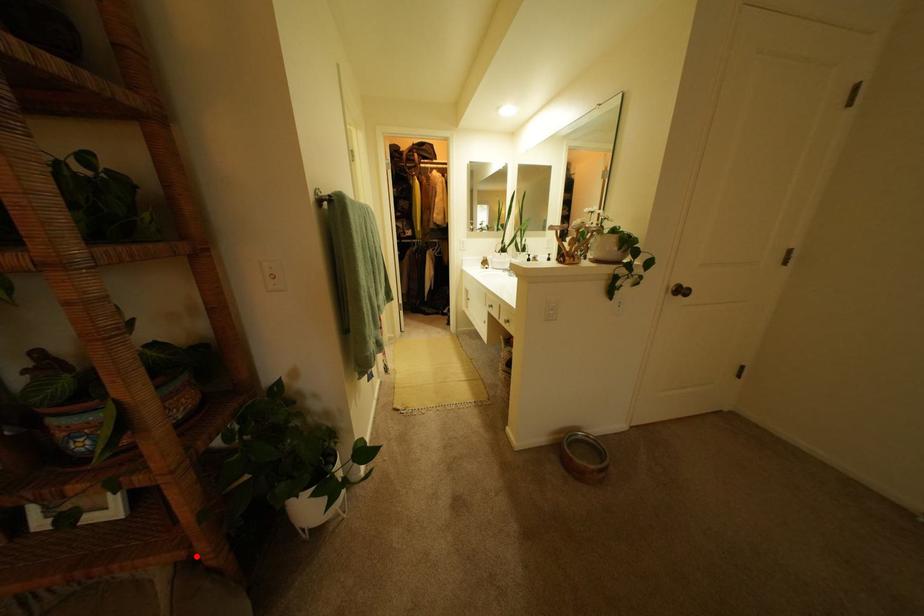
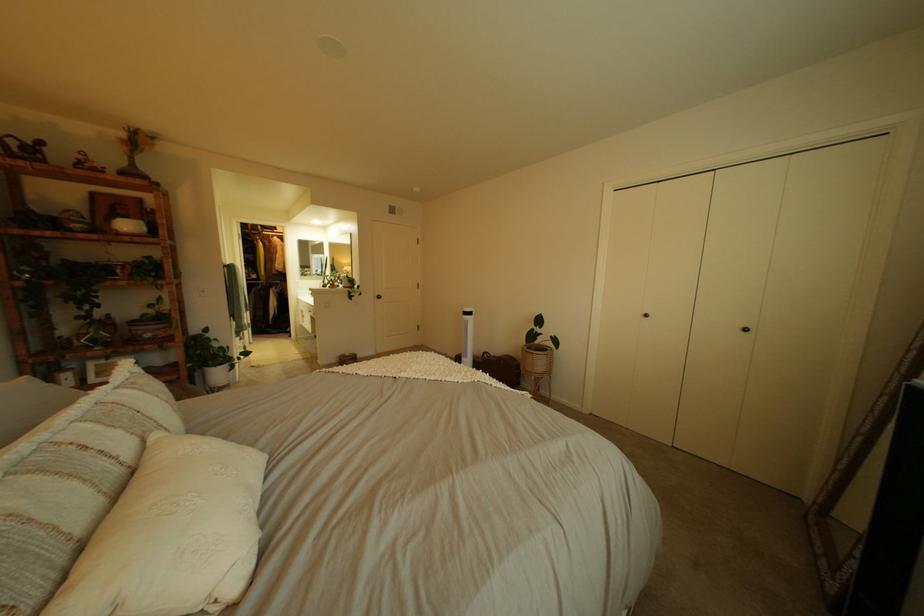
Locate, in the second image, the point that corresponds to the highlighted location in the first image.

(189, 379)